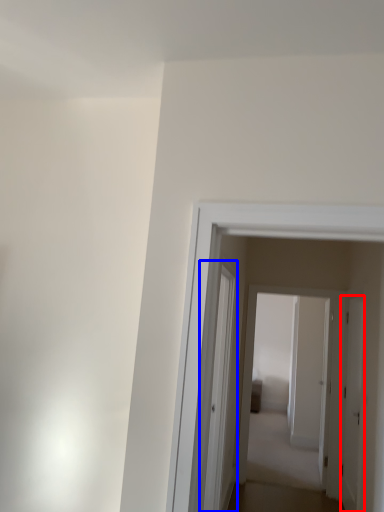
Question: Which object is closer to the camera taking this photo, door (highlighted by a red box) or glass door (highlighted by a blue box)?

Choices:
 (A) door
 (B) glass door

Answer: (B)